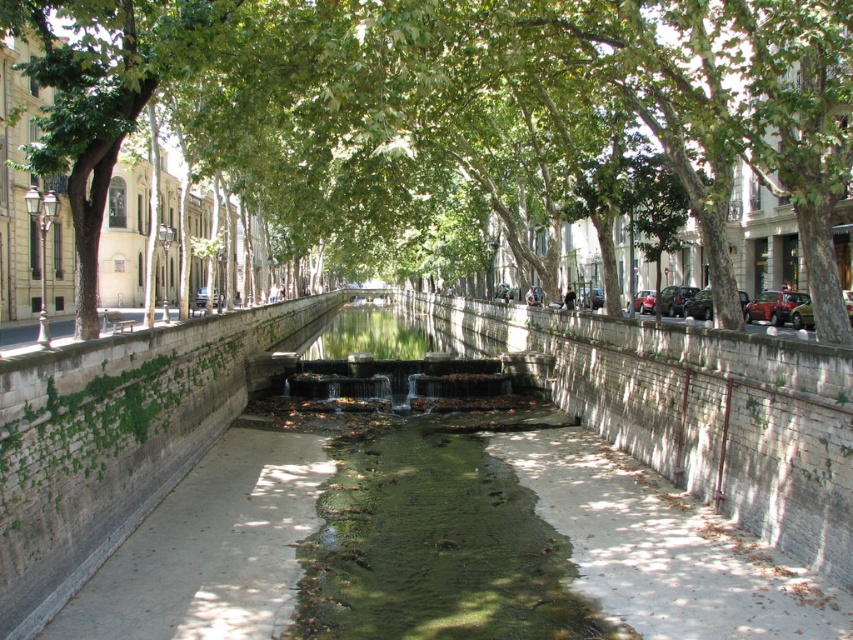
You are a tourist standing on the smooth concrete pavement at center and want to take a photo of the green leafy tree at center. To get the best shot, should you move to your left or right?

The green leafy tree at center is positioned on the right side of smooth concrete pavement at center, so you should move to your left to get a better view of the tree.

You are standing at the edge of the canal and want to take a photo of the green leafy tree at center. If your camera has a maximum focus range of 30 feet, will it be able to capture the tree clearly?

The green leafy tree at center is 31.14 feet away from the camera, which exceeds the maximum focus range of 30 feet. Therefore, the camera may not be able to capture the tree clearly.